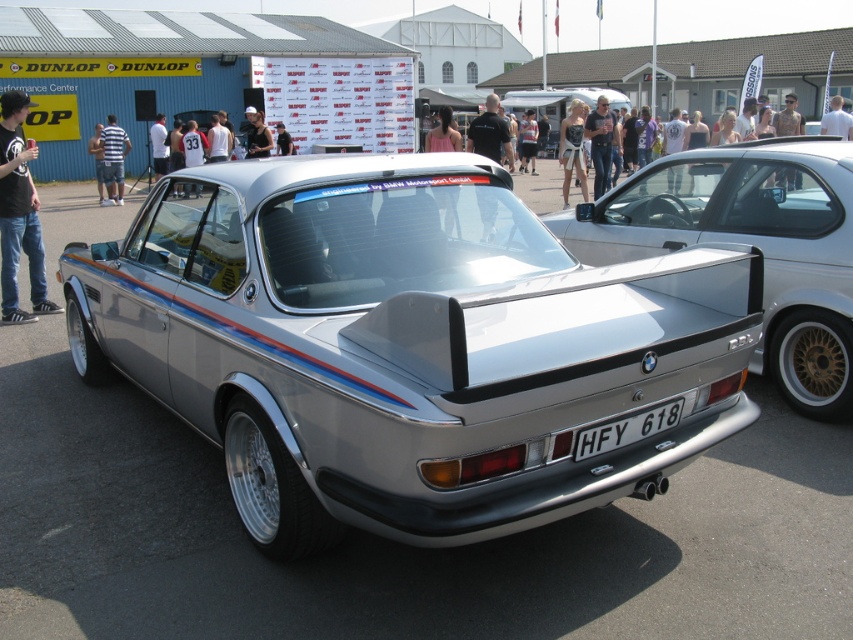
Question: Which point is closer to the camera taking this photo?

Choices:
 (A) (120, 180)
 (B) (606, 387)
 (C) (148, 131)

Answer: (B)

Question: Can you confirm if silver metallic car at center is bigger than denim skirt at center?

Choices:
 (A) no
 (B) yes

Answer: (A)

Question: Is pink fabric dress at center thinner than dark hair at center?

Choices:
 (A) yes
 (B) no

Answer: (B)

Question: Which point is farther from the camera taking this photo?

Choices:
 (A) (821, 118)
 (B) (579, 148)

Answer: (A)

Question: Is black fabric shirt at center above dark hair at center?

Choices:
 (A) yes
 (B) no

Answer: (A)

Question: Which point appears closest to the camera in this image?

Choices:
 (A) click(x=601, y=106)
 (B) click(x=97, y=128)

Answer: (A)